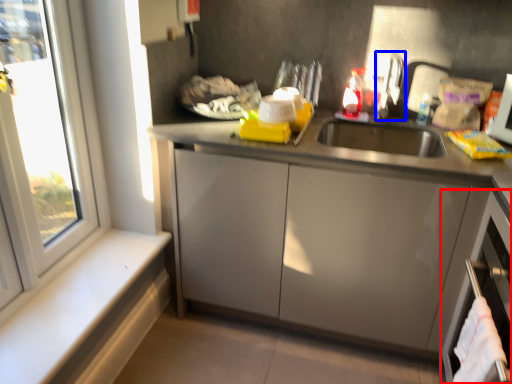
Question: Which object is further to the camera taking this photo, dish washer (highlighted by a red box) or faucet (highlighted by a blue box)?

Choices:
 (A) dish washer
 (B) faucet

Answer: (B)